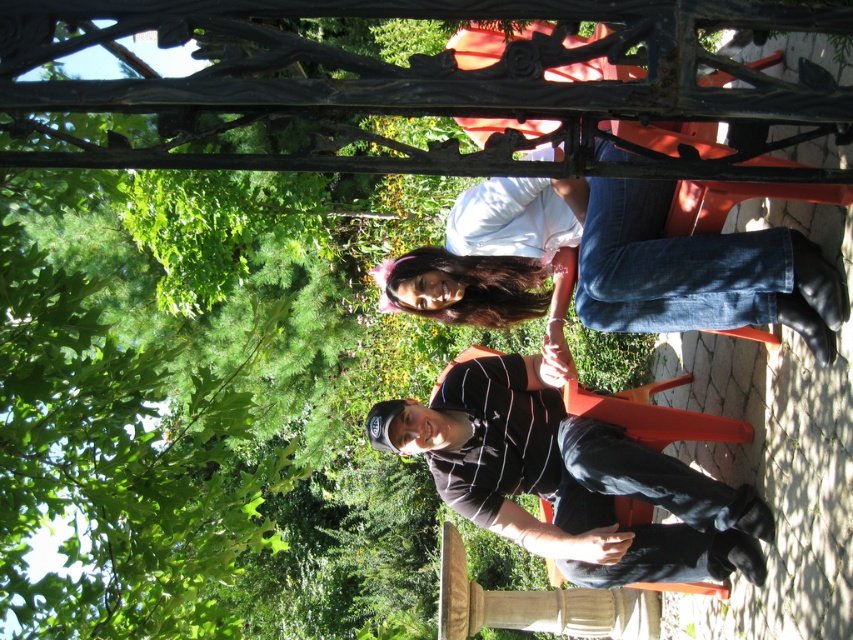
Is point (646, 490) farther from camera compared to point (825, 291)?

Yes, it is behind point (825, 291).

Based on the photo, can you confirm if black striped shirt at center is smaller than denim jeans at center?

No.

At what (x,y) coordinates should I click in order to perform the action: click on black striped shirt at center. Please return your answer as a coordinate pair (x, y). The height and width of the screenshot is (640, 853). Looking at the image, I should click on (567, 477).